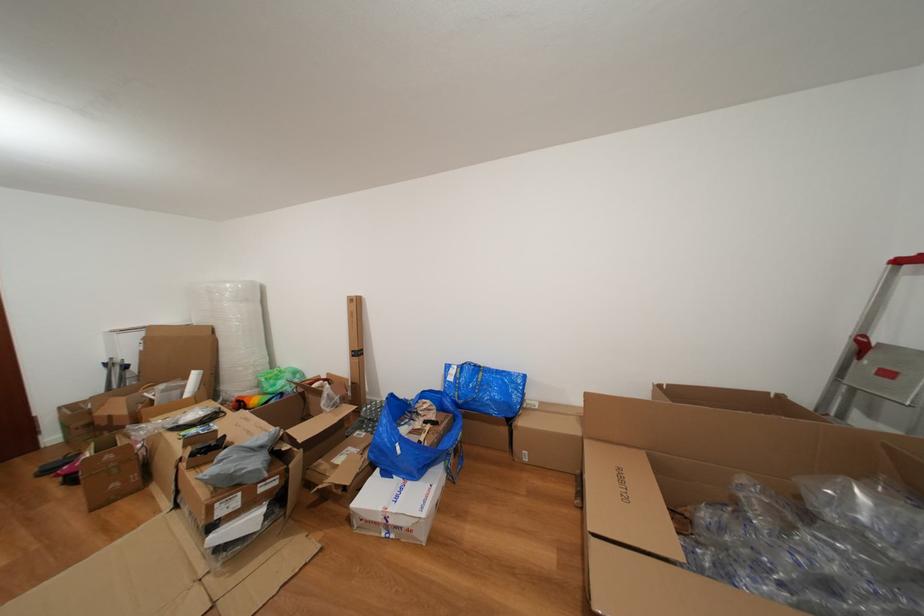
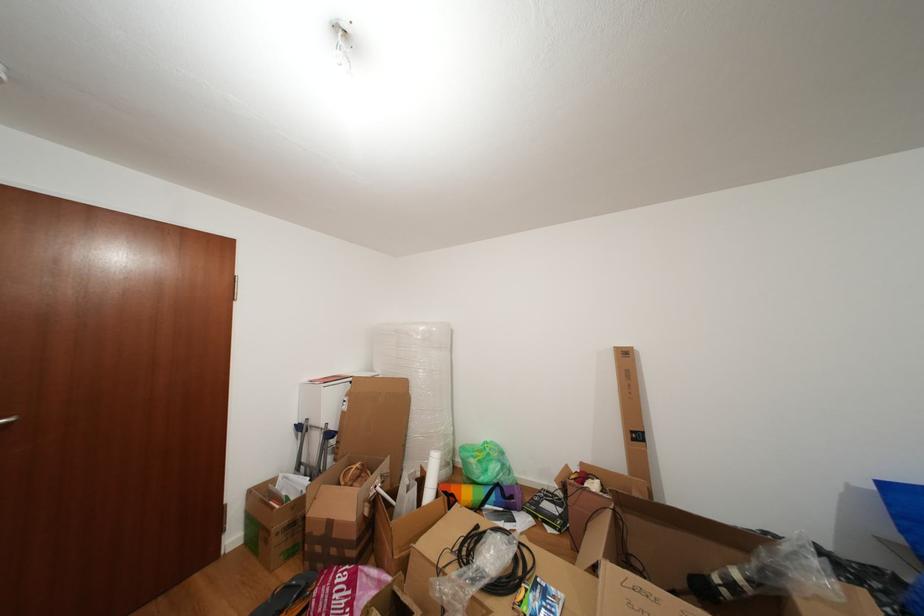
Find the pixel in the second image that matches (x=283, y=390) in the first image.

(494, 476)